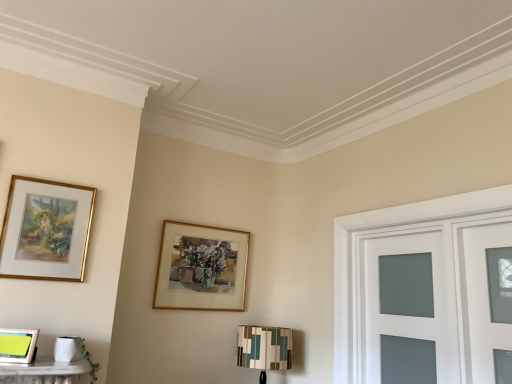
Question: Does gold-framed picture at upper center, placed as the third picture frame when sorted from front to back, have a smaller size compared to metallic silver picture frame at lower left, which appears as the 1th picture frame when viewed from the front?

Choices:
 (A) yes
 (B) no

Answer: (B)

Question: Does gold-framed picture at upper center, which is counted as the 3th picture frame, starting from the left, have a lesser height compared to metallic silver picture frame at lower left, which appears as the 1th picture frame when viewed from the front?

Choices:
 (A) yes
 (B) no

Answer: (B)

Question: Is gold-framed picture at upper center, placed as the third picture frame when sorted from front to back, thinner than metallic silver picture frame at lower left, which appears as the 1th picture frame when viewed from the front?

Choices:
 (A) no
 (B) yes

Answer: (B)

Question: From the image's perspective, does gold-framed picture at upper center, the 1th picture frame positioned from the right, appear higher than metallic silver picture frame at lower left, which is counted as the first picture frame, starting from the left?

Choices:
 (A) no
 (B) yes

Answer: (B)

Question: Is gold-framed picture at upper center, the 1th picture frame when ordered from back to front, positioned behind metallic silver picture frame at lower left, which is counted as the first picture frame, starting from the left?

Choices:
 (A) no
 (B) yes

Answer: (B)

Question: In the image, is multicolored fabric lampshade at lower right on the left side or the right side of gold-framed picture at upper center, the 1th picture frame when ordered from back to front?

Choices:
 (A) right
 (B) left

Answer: (A)

Question: Considering the positions of multicolored fabric lampshade at lower right and gold-framed picture at upper center, the 1th picture frame when ordered from back to front, in the image, is multicolored fabric lampshade at lower right taller or shorter than gold-framed picture at upper center, the 1th picture frame when ordered from back to front,?

Choices:
 (A) tall
 (B) short

Answer: (B)

Question: Is point (249, 349) positioned closer to the camera than point (207, 289)?

Choices:
 (A) farther
 (B) closer

Answer: (B)

Question: In the image, is multicolored fabric lampshade at lower right positioned in front of or behind gold-framed picture at upper center, the 1th picture frame positioned from the right?

Choices:
 (A) front
 (B) behind

Answer: (A)

Question: Is gold-framed painting at upper left, the second picture frame positioned from the right, to the left or to the right of multicolored fabric lampshade at lower right in the image?

Choices:
 (A) left
 (B) right

Answer: (A)

Question: From the image's perspective, is gold-framed painting at upper left, the second picture frame positioned from the right, located above or below multicolored fabric lampshade at lower right?

Choices:
 (A) below
 (B) above

Answer: (B)

Question: Is gold-framed painting at upper left, the second picture frame positioned from the right, inside the boundaries of multicolored fabric lampshade at lower right, or outside?

Choices:
 (A) outside
 (B) inside

Answer: (A)

Question: In terms of size, does gold-framed painting at upper left, acting as the second picture frame starting from the front, appear bigger or smaller than multicolored fabric lampshade at lower right?

Choices:
 (A) big
 (B) small

Answer: (B)

Question: Considering the positions of point (178, 240) and point (393, 253), is point (178, 240) closer or farther from the camera than point (393, 253)?

Choices:
 (A) closer
 (B) farther

Answer: (B)

Question: Relative to matte glass door at right, is gold-framed picture at upper center, the 1th picture frame positioned from the right, in front or behind?

Choices:
 (A) front
 (B) behind

Answer: (B)